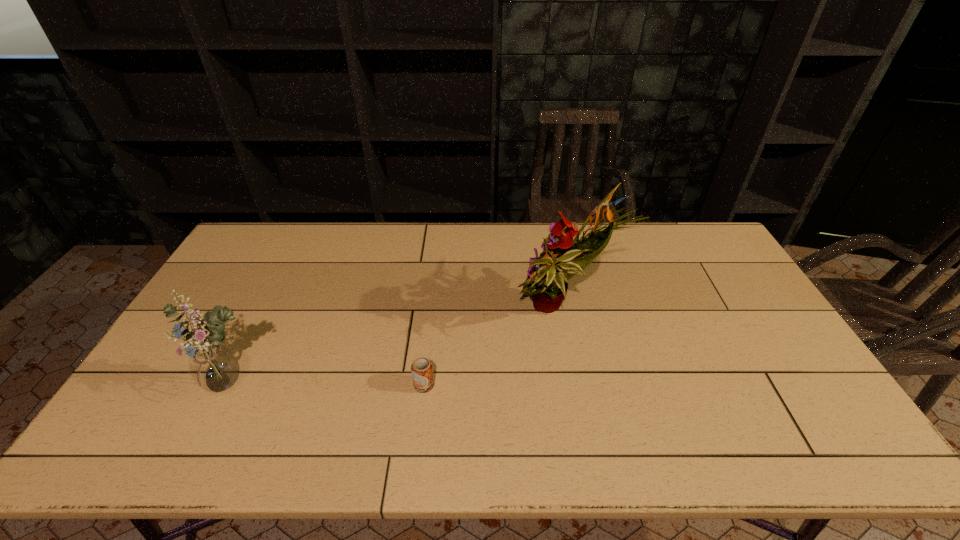
Image resolution: width=960 pixels, height=540 pixels. I want to click on free space between the shortest object and the taller bouquet, so click(x=493, y=349).

This screenshot has width=960, height=540. I want to click on free space between the tallest object and the beer can, so click(493, 349).

This screenshot has height=540, width=960. I want to click on free space between the shortest object and the farthest object, so click(493, 349).

Identify the location of empty space between the left bouquet and the second object from right to left. This screenshot has width=960, height=540. (328, 385).

In order to click on vacant space that's between the left bouquet and the farther bouquet in this screenshot , I will do `click(397, 349)`.

Locate an element on the screen. vacant area that lies between the shortest object and the leftmost object is located at coordinates (328, 385).

At what (x,y) coordinates should I click in order to perform the action: click on free spot between the leftmost object and the farther bouquet. Please return your answer as a coordinate pair (x, y). Looking at the image, I should click on (397, 349).

This screenshot has height=540, width=960. What are the coordinates of `object that is the closest to the taller bouquet` in the screenshot? It's located at (422, 369).

At what (x,y) coordinates should I click in order to perform the action: click on the second closest object to the nearer bouquet. Please return your answer as a coordinate pair (x, y). This screenshot has height=540, width=960. Looking at the image, I should click on pyautogui.click(x=563, y=257).

The height and width of the screenshot is (540, 960). Identify the location of free space that satisfies the following two spatial constraints: 1. on the front-facing side of the second object from right to left; 2. on the left side of the leftmost object. (232, 385).